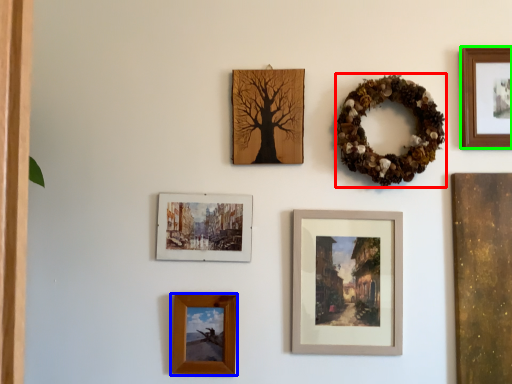
Question: Which object is positioned closest to decor (highlighted by a red box)? Select from picture frame (highlighted by a blue box) and picture frame (highlighted by a green box).

Choices:
 (A) picture frame
 (B) picture frame

Answer: (B)